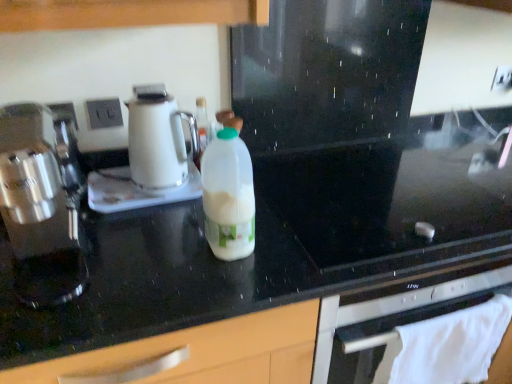
Question: Can you confirm if black glass gas stove at center is positioned to the right of white plastic bottle at center?

Choices:
 (A) yes
 (B) no

Answer: (A)

Question: From a real-world perspective, is black glass gas stove at center positioned over white plastic bottle at center based on gravity?

Choices:
 (A) no
 (B) yes

Answer: (A)

Question: Can you confirm if black glass gas stove at center is bigger than white plastic bottle at center?

Choices:
 (A) yes
 (B) no

Answer: (A)

Question: Is black glass gas stove at center positioned behind white plastic bottle at center?

Choices:
 (A) yes
 (B) no

Answer: (A)

Question: Would you consider black glass gas stove at center to be distant from white plastic bottle at center?

Choices:
 (A) no
 (B) yes

Answer: (A)

Question: From the image's perspective, is white cloth towel at lower right positioned above or below white glossy kettle at center?

Choices:
 (A) below
 (B) above

Answer: (A)

Question: Do you think white cloth towel at lower right is within white glossy kettle at center, or outside of it?

Choices:
 (A) outside
 (B) inside

Answer: (A)

Question: In terms of height, does white cloth towel at lower right look taller or shorter compared to white glossy kettle at center?

Choices:
 (A) tall
 (B) short

Answer: (A)

Question: Relative to white glossy kettle at center, is white cloth towel at lower right in front or behind?

Choices:
 (A) front
 (B) behind

Answer: (A)

Question: From a real-world perspective, relative to white plastic bottle at center, is white plastic electric outlet at upper center, the first electric outlet when ordered from top to bottom, vertically above or below?

Choices:
 (A) above
 (B) below

Answer: (A)

Question: Is white plastic electric outlet at upper center, which is the 2th electric outlet in bottom-to-top order, wider or thinner than white plastic bottle at center?

Choices:
 (A) wide
 (B) thin

Answer: (B)

Question: Do you think white plastic electric outlet at upper center, positioned as the first electric outlet in right-to-left order, is within white plastic bottle at center, or outside of it?

Choices:
 (A) inside
 (B) outside

Answer: (B)

Question: Visually, is white plastic electric outlet at upper center, placed as the second electric outlet when sorted from left to right, positioned to the left or to the right of white plastic bottle at center?

Choices:
 (A) right
 (B) left

Answer: (A)

Question: From a real-world perspective, is white cloth towel at lower right above or below black glass gas stove at center?

Choices:
 (A) above
 (B) below

Answer: (B)

Question: Is white cloth towel at lower right to the left or to the right of black glass gas stove at center in the image?

Choices:
 (A) left
 (B) right

Answer: (B)